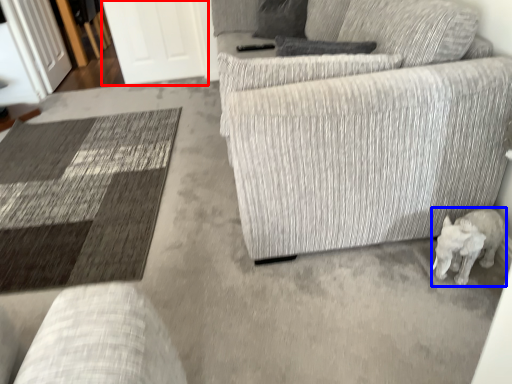
Question: Among these objects, which one is farthest to the camera, glass door (highlighted by a red box) or animal (highlighted by a blue box)?

Choices:
 (A) glass door
 (B) animal

Answer: (A)